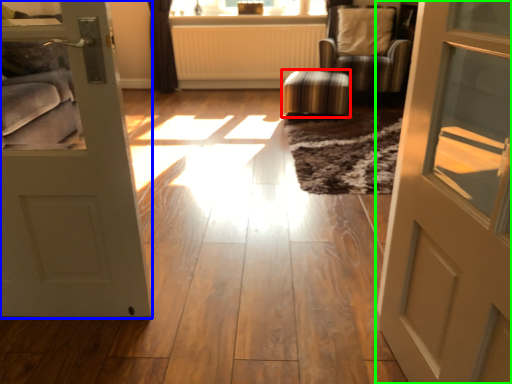
Question: Considering the real-world distances, which object is farthest from stool (highlighted by a red box)? door (highlighted by a blue box) or door (highlighted by a green box)?

Choices:
 (A) door
 (B) door

Answer: (B)